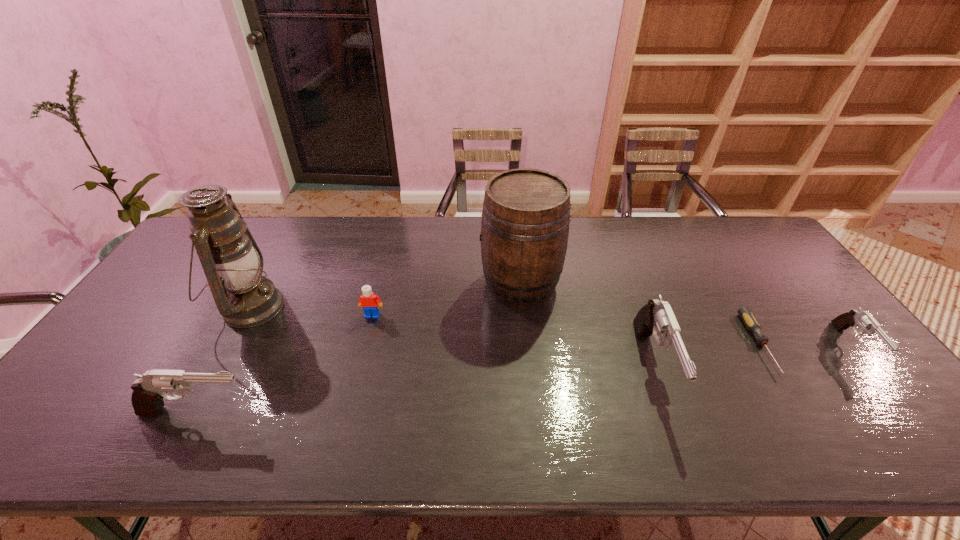
In the image, there is a desktop. In order to click on free region at the near edge in this screenshot , I will do 249,402.

In the image, there is a desktop. Identify the location of vacant space at the right edge. (x=781, y=281).

The height and width of the screenshot is (540, 960). In order to click on vacant region at the far right corner of the desktop in this screenshot , I will do `click(720, 225)`.

I want to click on free point between the oil lamp and the second gun from right to left, so click(452, 337).

Where is `empty location between the shortest gun and the Lego`? empty location between the shortest gun and the Lego is located at coordinates (612, 331).

Where is `free area in between the fifth object from right to left and the sixth object from left to right`? free area in between the fifth object from right to left and the sixth object from left to right is located at coordinates (566, 330).

This screenshot has height=540, width=960. In order to click on free space between the oil lamp and the shortest object in this screenshot , I will do `click(505, 326)`.

Where is `free spot between the Lego and the fourth shortest object`? The height and width of the screenshot is (540, 960). free spot between the Lego and the fourth shortest object is located at coordinates 285,364.

The image size is (960, 540). Find the location of `vacant space that is in between the fourth shortest object and the rightmost object`. vacant space that is in between the fourth shortest object and the rightmost object is located at coordinates click(525, 379).

At what (x,y) coordinates should I click in order to perform the action: click on empty space between the second gun from right to left and the second tallest object. Please return your answer as a coordinate pair (x, y). This screenshot has height=540, width=960. Looking at the image, I should click on (587, 325).